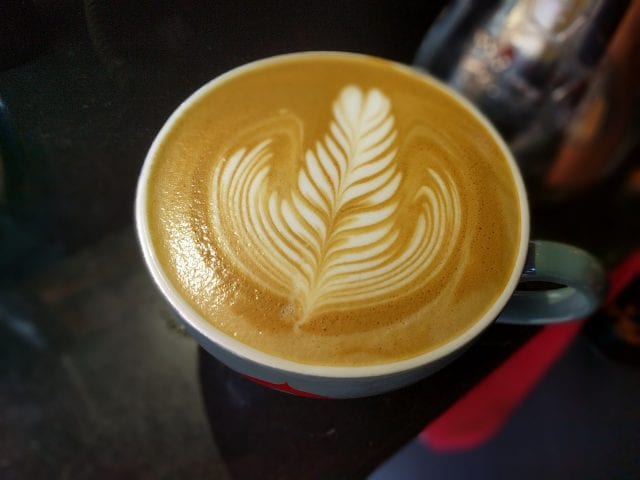
Where is `floor`? This screenshot has height=480, width=640. floor is located at coordinates (566, 419).